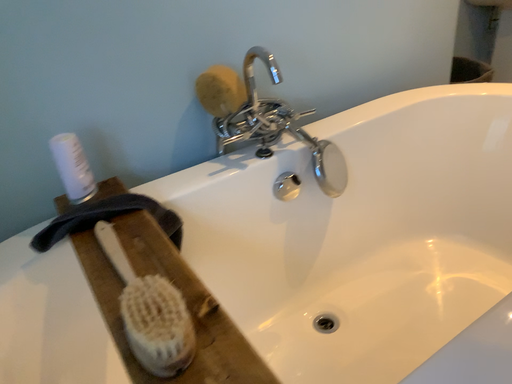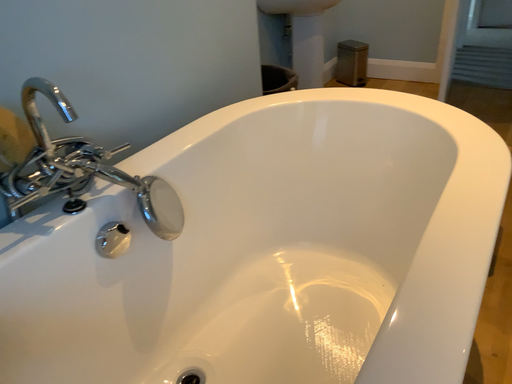
Question: Which way did the camera rotate in the video?

Choices:
 (A) rotated left
 (B) rotated right

Answer: (B)